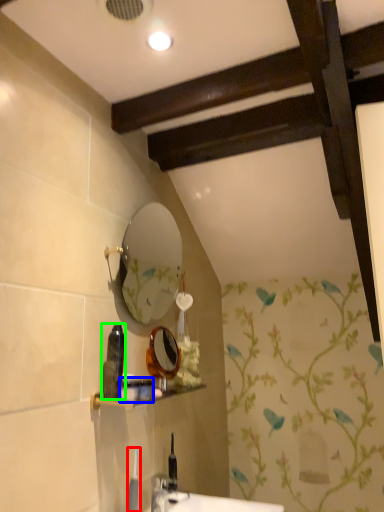
Question: Estimate the real-world distances between objects in this image. Which object is farther from toiletry (highlighted by a red box), toiletry (highlighted by a blue box) or toiletry (highlighted by a green box)?

Choices:
 (A) toiletry
 (B) toiletry

Answer: (B)